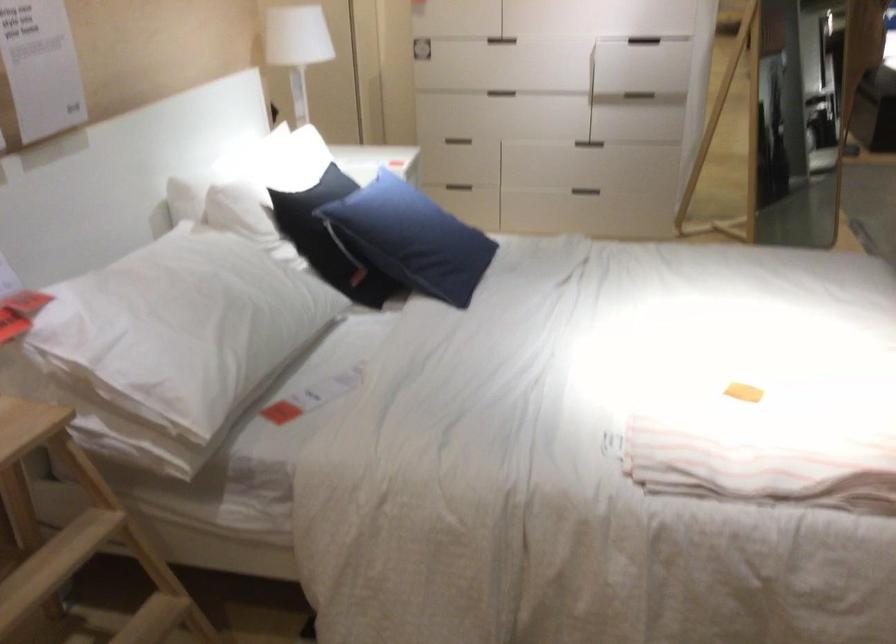
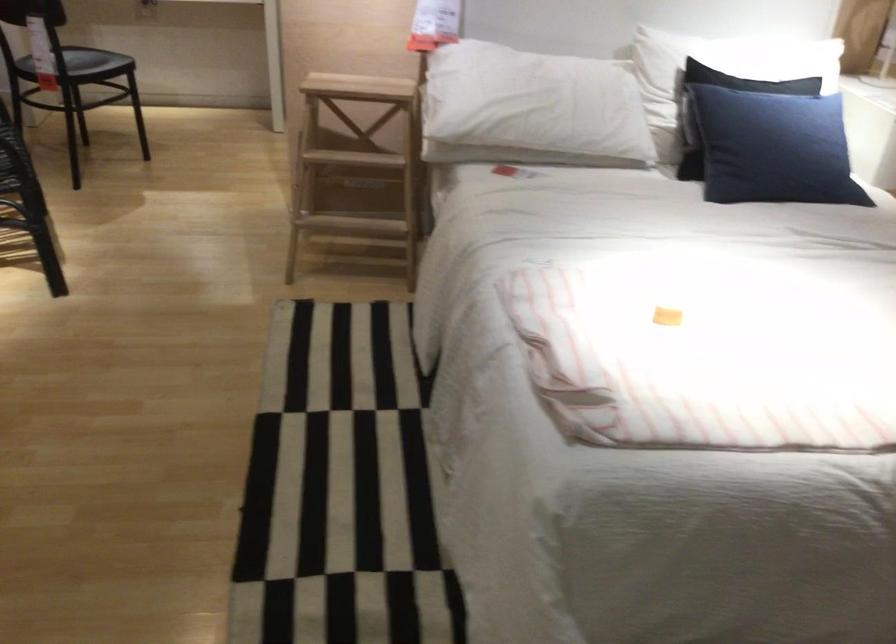
Locate, in the second image, the point that corresponds to pixel 449 240 in the first image.

(773, 147)